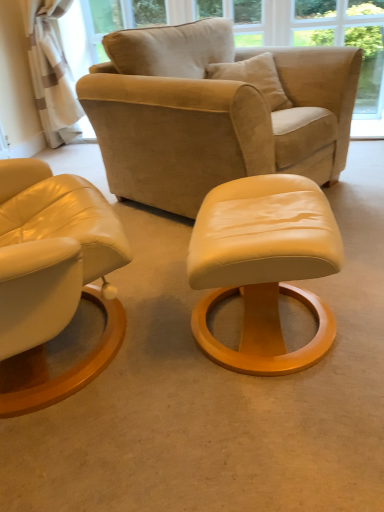
This screenshot has width=384, height=512. I want to click on vacant space to the right of matte cream leather ottoman at center, so click(x=355, y=302).